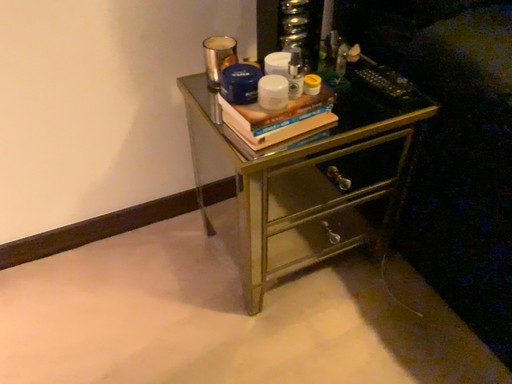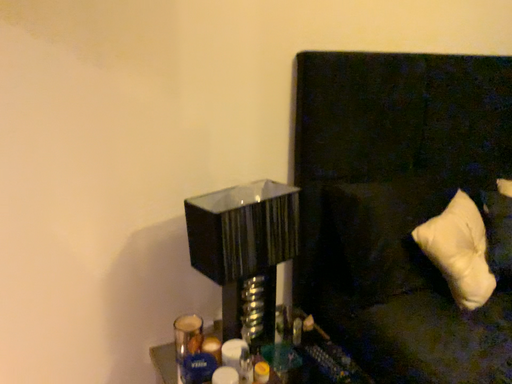
Question: Which way did the camera rotate in the video?

Choices:
 (A) rotated downward
 (B) rotated upward

Answer: (B)